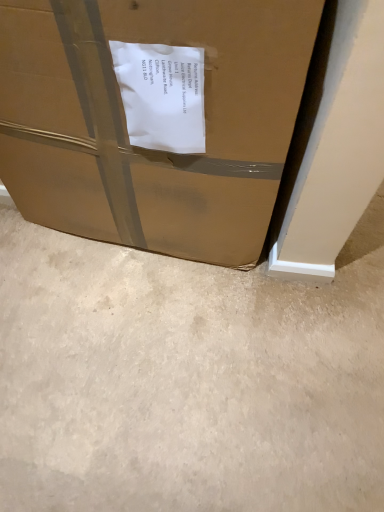
Image resolution: width=384 pixels, height=512 pixels. What are the coordinates of `free space in front of brown cardboard box at lower left` in the screenshot? It's located at (165, 360).